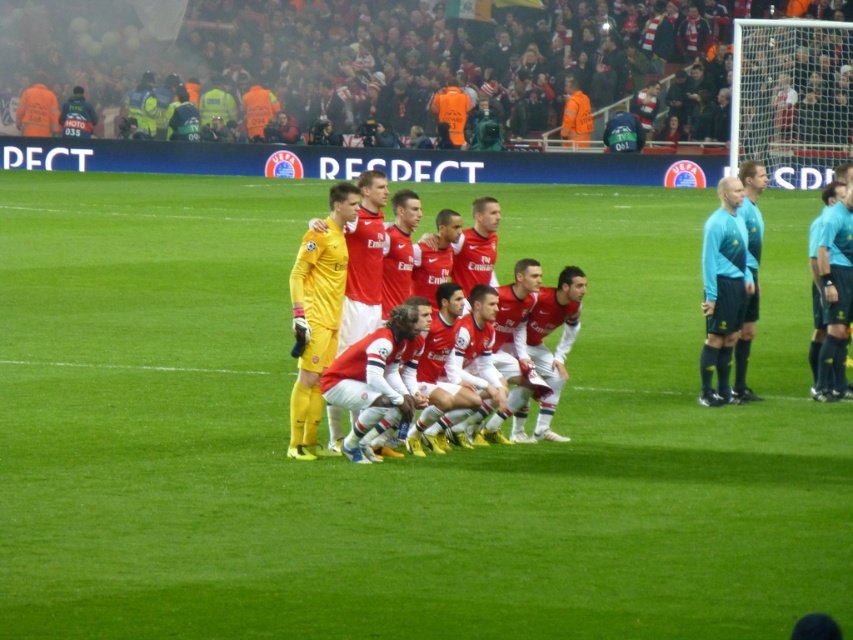
Question: Does green grass football field at center have a larger size compared to matte red jersey at center?

Choices:
 (A) yes
 (B) no

Answer: (A)

Question: Can you confirm if matte red jersey at center is positioned above light blue jersey at right?

Choices:
 (A) no
 (B) yes

Answer: (B)

Question: Can you confirm if light blue jersey at right is positioned above light blue jersey at center?

Choices:
 (A) yes
 (B) no

Answer: (B)

Question: Which point appears farthest from the camera in this image?

Choices:
 (A) (409, 234)
 (B) (747, 237)
 (C) (746, 294)

Answer: (B)

Question: Which is farther from the green grass football field at center?

Choices:
 (A) light blue jersey at center
 (B) light blue jersey at right
 (C) matte red jersey at center

Answer: (C)

Question: Which of these objects is positioned closest to the light blue jersey at right?

Choices:
 (A) light blue jersey at center
 (B) green grass football field at center

Answer: (A)